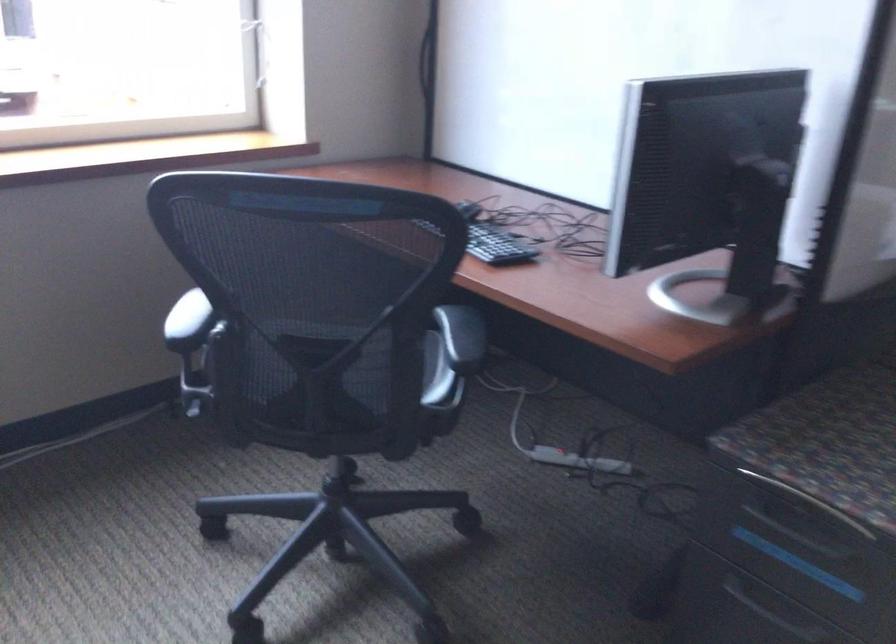
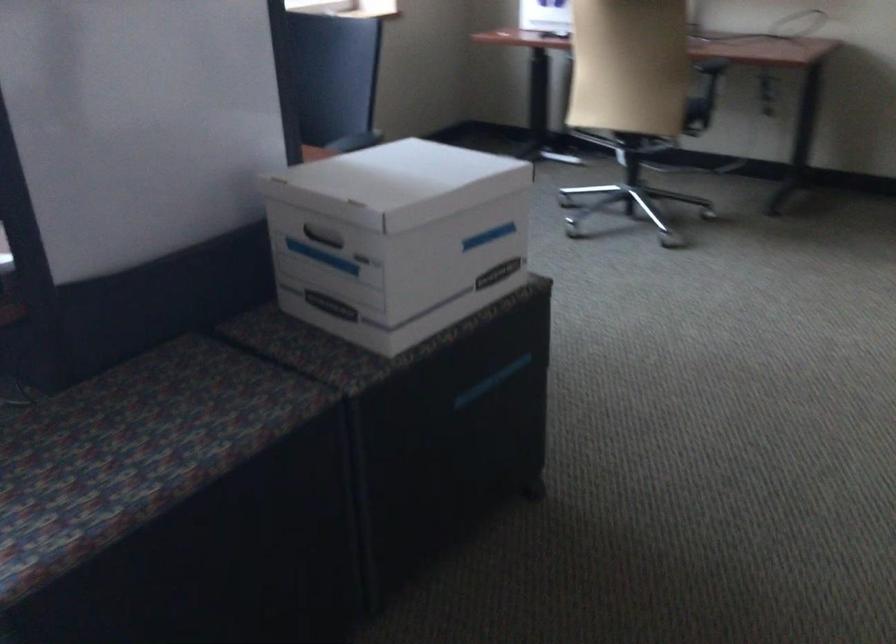
Question: The images are taken continuously from a first-person perspective. In which direction are you moving?

Choices:
 (A) Left
 (B) Right
 (C) Forward
 (D) Backward

Answer: (B)